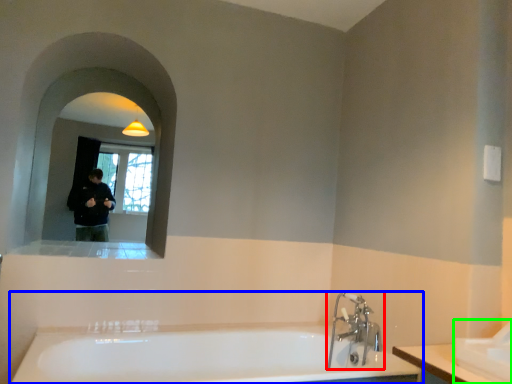
Question: Which object is positioned closest to tap (highlighted by a red box)? Select from bathtub (highlighted by a blue box) and sink (highlighted by a green box).

Choices:
 (A) bathtub
 (B) sink

Answer: (A)